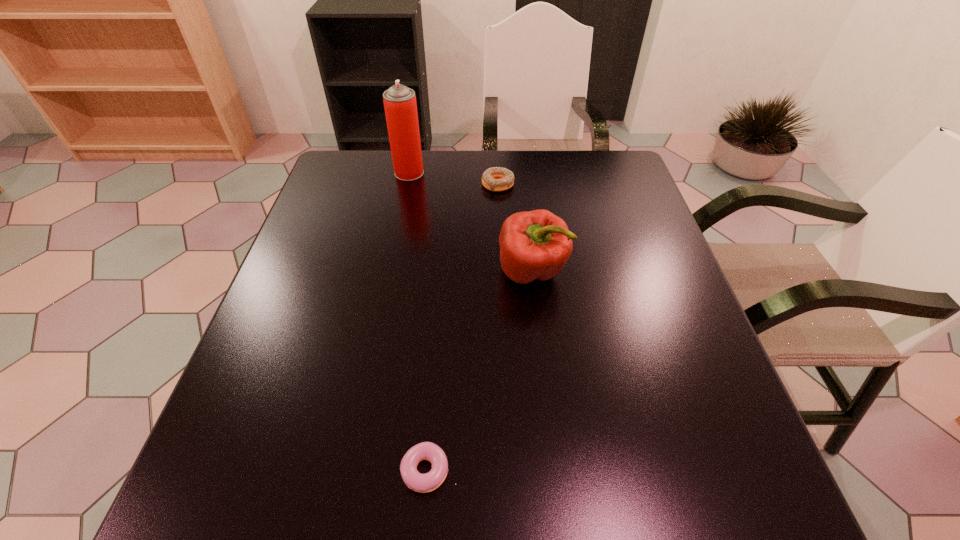
This screenshot has width=960, height=540. In order to click on aerosol can in this screenshot , I will do `click(400, 105)`.

You are a GUI agent. You are given a task and a screenshot of the screen. Output one action in this format:
    pyautogui.click(x=<x>, y=<y>)
    Task: Click on the tallest object
    This screenshot has height=540, width=960.
    Given the screenshot: What is the action you would take?
    pyautogui.click(x=400, y=105)

In order to click on bell pepper in this screenshot , I will do `click(536, 244)`.

Where is `the third shortest object`? The height and width of the screenshot is (540, 960). the third shortest object is located at coordinates (536, 244).

Where is `the second shortest object`? the second shortest object is located at coordinates (496, 179).

The height and width of the screenshot is (540, 960). Find the location of `the right doughnut`. the right doughnut is located at coordinates (496, 179).

Locate an element on the screen. The image size is (960, 540). the nearer doughnut is located at coordinates (423, 483).

The height and width of the screenshot is (540, 960). I want to click on the shortest object, so click(x=423, y=483).

Find the location of a particular element. free region located on the front of the tallest object is located at coordinates (404, 200).

Locate an element on the screen. The width and height of the screenshot is (960, 540). blank space located 0.110m on the right of the second nearest object is located at coordinates (614, 272).